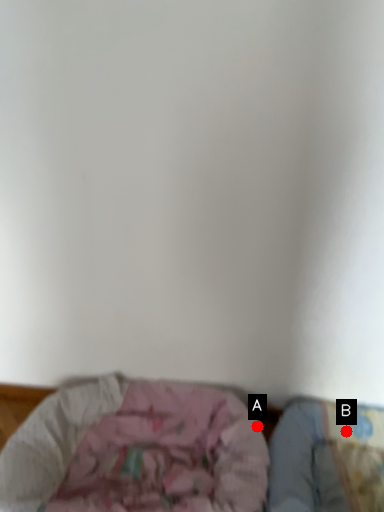
Question: Two points are circled on the image, labeled by A and B beside each circle. Which point is closer to the camera?

Choices:
 (A) A is closer
 (B) B is closer

Answer: (A)